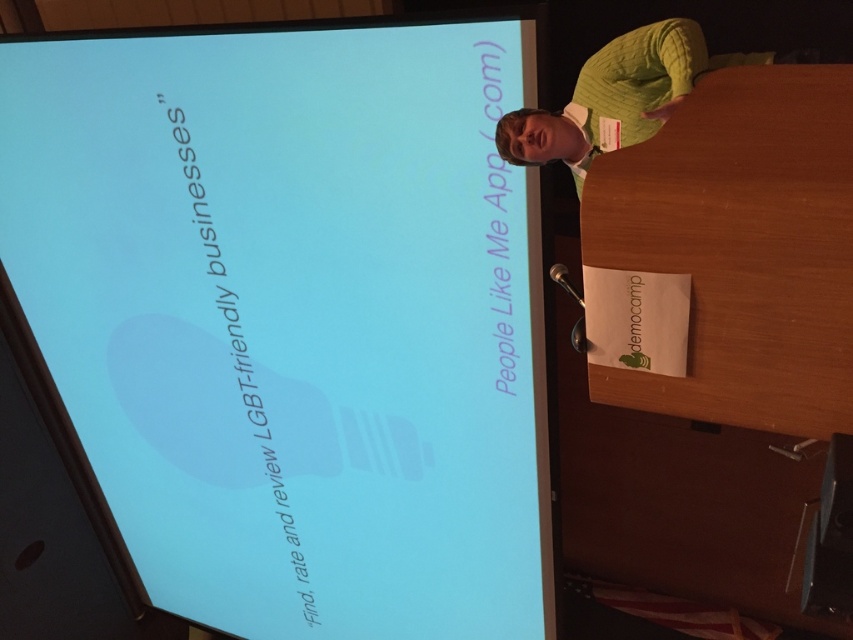
What is the position of the matte blue screen at upper left relative to the green knitted sweater at upper right?

The matte blue screen at upper left is to the left of the green knitted sweater at upper right.

You are a photographer taking a photo of the speaker at the podium. The matte blue screen at upper left is part of the background. To ensure the screen is centered in your photo, where should you position the camera relative to the speaker?

The matte blue screen at upper left is located at point (293,317) in 2D space, so you should position the camera so that the screen is centered by aligning the camera to that coordinate.

What is the position of the matte blue screen at upper left relative to the green knitted sweater at upper right?

The matte blue screen at upper left is located below the green knitted sweater at upper right.